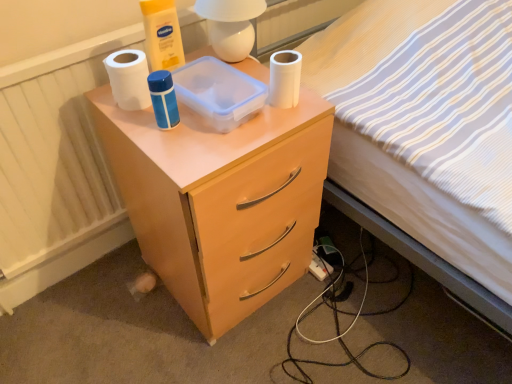
The width and height of the screenshot is (512, 384). Identify the location of free space in front of white matte toilet paper at upper center, which appears as the 2th toilet paper when viewed from the left. (267, 132).